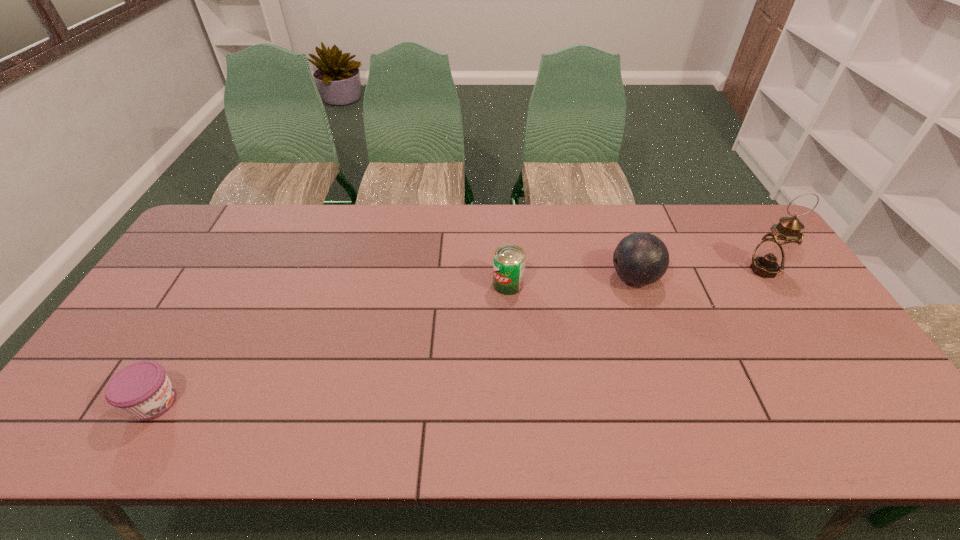
Image resolution: width=960 pixels, height=540 pixels. Identify the location of free space that is in between the can and the shortest object. [331, 343].

Locate an element on the screen. This screenshot has width=960, height=540. unoccupied area between the leftmost object and the oil lamp is located at coordinates (459, 336).

Locate an element on the screen. The width and height of the screenshot is (960, 540). object that is the third closest to the can is located at coordinates (142, 389).

You are a GUI agent. You are given a task and a screenshot of the screen. Output one action in this format:
    pyautogui.click(x=<x>, y=<y>)
    Task: Click on the object that stands as the closest to the bowling ball
    Image resolution: width=960 pixels, height=540 pixels.
    Given the screenshot: What is the action you would take?
    pyautogui.click(x=509, y=260)

Find the location of `vacant point that satisfies the following two spatial constraints: 1. on the front side of the third tallest object; 2. on the front label of the nearest object`. vacant point that satisfies the following two spatial constraints: 1. on the front side of the third tallest object; 2. on the front label of the nearest object is located at coordinates (516, 403).

Identify the location of free space that satisfies the following two spatial constraints: 1. on the front side of the tallest object; 2. on the front label of the leftmost object. This screenshot has height=540, width=960. (850, 403).

Where is `free spot that satisfies the following two spatial constraints: 1. on the back side of the second object from left to right; 2. on the right side of the oil lamp`? The width and height of the screenshot is (960, 540). free spot that satisfies the following two spatial constraints: 1. on the back side of the second object from left to right; 2. on the right side of the oil lamp is located at coordinates (507, 270).

Image resolution: width=960 pixels, height=540 pixels. Find the location of `free region that satisfies the following two spatial constraints: 1. on the back side of the tallest object; 2. on the left side of the can`. free region that satisfies the following two spatial constraints: 1. on the back side of the tallest object; 2. on the left side of the can is located at coordinates (507, 270).